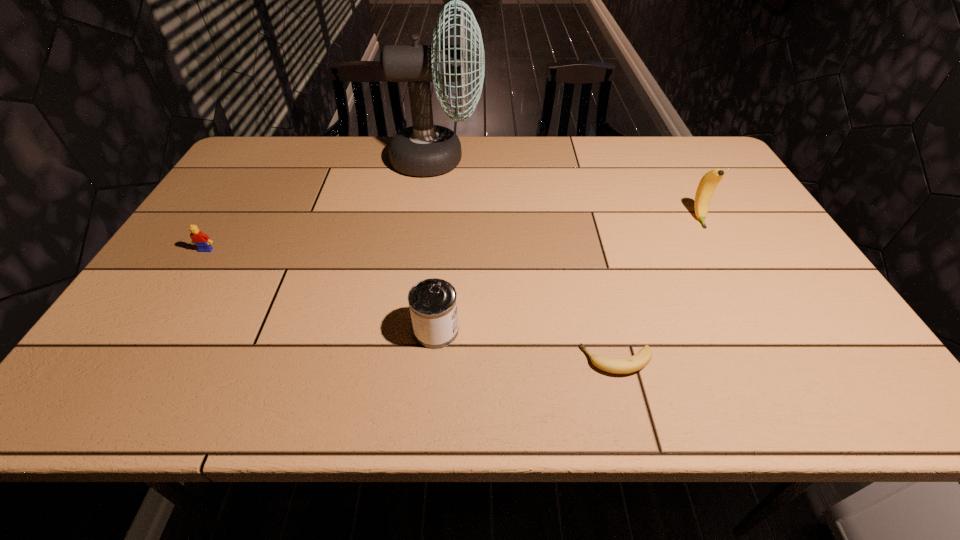
Where is `free space located from the stem of the rightmost object`? free space located from the stem of the rightmost object is located at coordinates (759, 329).

In order to click on free point located on the left of the third tallest object in this screenshot , I will do `click(308, 330)`.

Identify the location of vacant space located 0.250m on the face of the Lego. (x=155, y=331).

Locate an element on the screen. vacant space situated 0.300m at the stem of the left banana is located at coordinates tap(436, 361).

This screenshot has height=540, width=960. What are the coordinates of `free location located 0.150m at the stem of the left banana` in the screenshot? It's located at (509, 361).

Identify the location of vacant area situated 0.120m at the stem of the left banana. (523, 361).

Identify the location of object located in the far edge section of the desktop. The width and height of the screenshot is (960, 540). (x=424, y=149).

Locate an element on the screen. The image size is (960, 540). object that is positioned at the near edge is located at coordinates (638, 361).

Locate an element on the screen. Image resolution: width=960 pixels, height=540 pixels. object that is at the left edge is located at coordinates (202, 241).

Find the location of a particular element. The image size is (960, 540). object at the right edge is located at coordinates (707, 185).